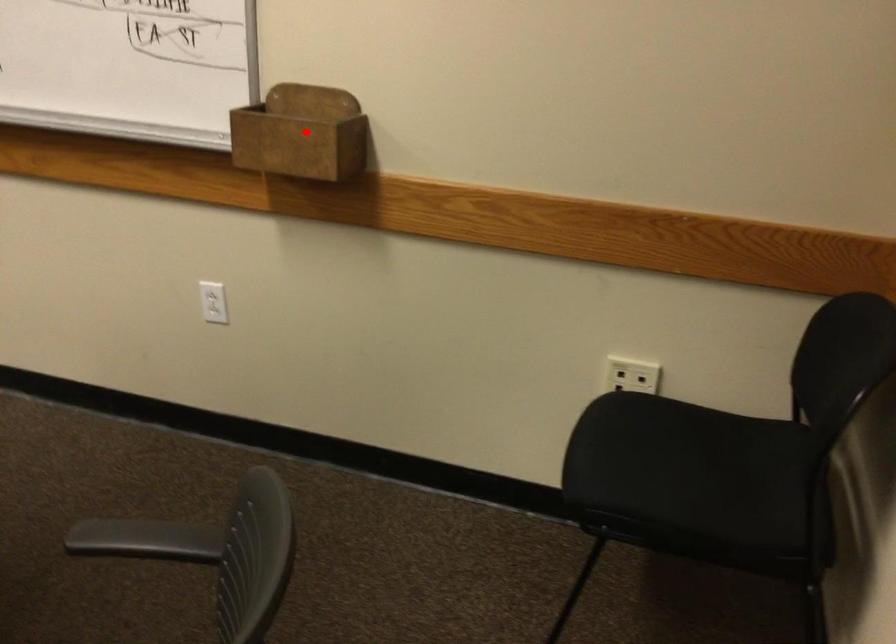
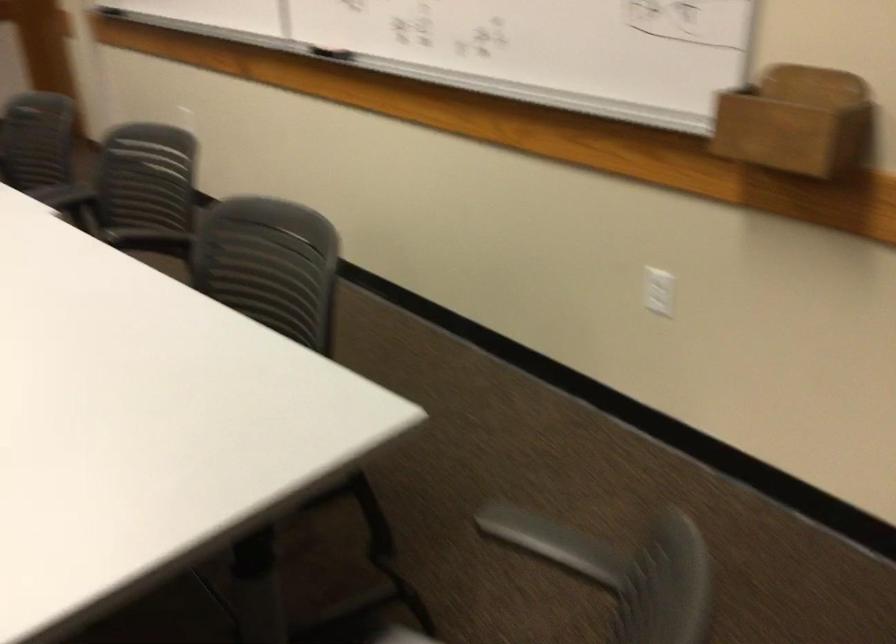
Question: I am providing you with two images of the same scene from different viewpoints. Given a red point in image1, look at the same physical point in image2. Is it:

Choices:
 (A) Closer to the viewpoint
 (B) Farther from the viewpoint

Answer: (A)